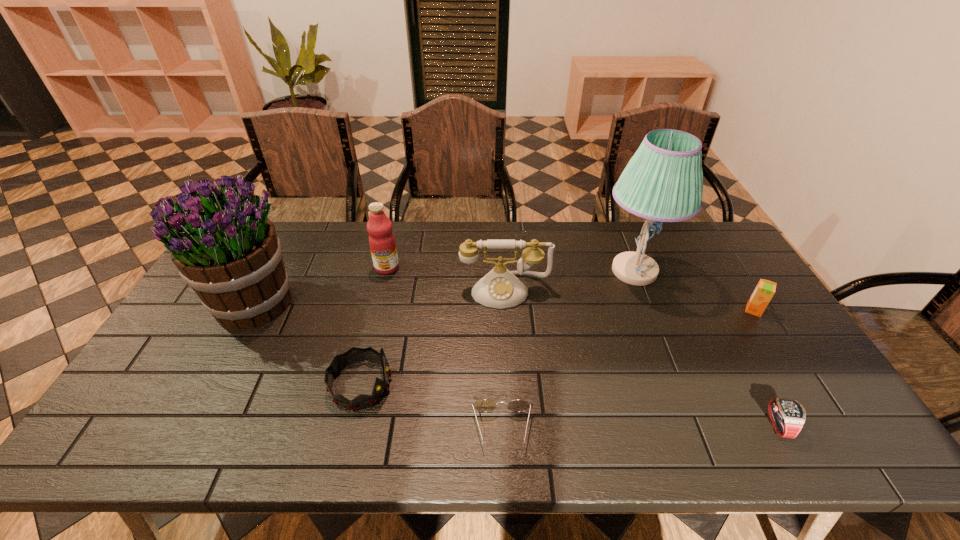
Locate an element on the screen. The width and height of the screenshot is (960, 540). lamp is located at coordinates (663, 182).

Identify the location of the leftmost object. The height and width of the screenshot is (540, 960). (226, 249).

Identify the location of the third tallest object. The height and width of the screenshot is (540, 960). (382, 243).

Identify the location of the fifth shortest object. This screenshot has height=540, width=960. (500, 288).

This screenshot has height=540, width=960. Find the location of `the rightmost object`. the rightmost object is located at coordinates (765, 289).

Identify the location of tiara. This screenshot has height=540, width=960. (354, 355).

This screenshot has width=960, height=540. I want to click on the second object from right to left, so click(787, 416).

Where is `watch`? The width and height of the screenshot is (960, 540). watch is located at coordinates (787, 416).

Find the location of a particular element. The height and width of the screenshot is (540, 960). spectacles is located at coordinates (485, 405).

The image size is (960, 540). I want to click on vacant space located 0.240m on the front of the lamp, so click(x=669, y=360).